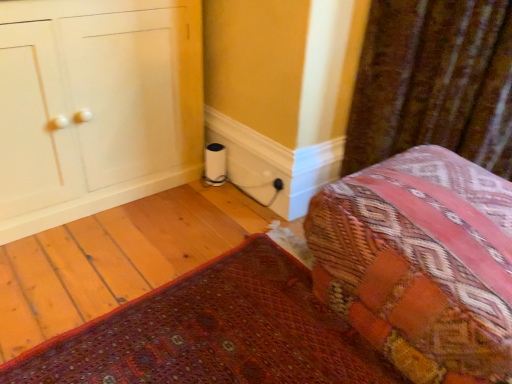
Question: Considering the relative sizes of textured woven bed at lower right and black plastic electric outlet at lower right in the image provided, is textured woven bed at lower right bigger than black plastic electric outlet at lower right?

Choices:
 (A) no
 (B) yes

Answer: (B)

Question: Considering the relative positions of textured woven bed at lower right and black plastic electric outlet at lower right in the image provided, is textured woven bed at lower right behind black plastic electric outlet at lower right?

Choices:
 (A) no
 (B) yes

Answer: (A)

Question: From a real-world perspective, is textured woven bed at lower right positioned over black plastic electric outlet at lower right based on gravity?

Choices:
 (A) no
 (B) yes

Answer: (B)

Question: Is the position of textured woven bed at lower right less distant than that of black plastic electric outlet at lower right?

Choices:
 (A) yes
 (B) no

Answer: (A)

Question: Can you confirm if textured woven bed at lower right is smaller than black plastic electric outlet at lower right?

Choices:
 (A) yes
 (B) no

Answer: (B)

Question: Is textured woven bed at lower right not close to black plastic electric outlet at lower right?

Choices:
 (A) yes
 (B) no

Answer: (B)

Question: Does patterned fabric cushion at lower right, marked as the second furniture in a top-to-bottom arrangement, come behind velvet brown curtain at upper right?

Choices:
 (A) yes
 (B) no

Answer: (B)

Question: Is velvet brown curtain at upper right located within patterned fabric cushion at lower right, marked as the second furniture in a top-to-bottom arrangement?

Choices:
 (A) no
 (B) yes

Answer: (A)

Question: Is patterned fabric cushion at lower right, marked as the second furniture in a top-to-bottom arrangement, shorter than velvet brown curtain at upper right?

Choices:
 (A) no
 (B) yes

Answer: (B)

Question: Is patterned fabric cushion at lower right, marked as the second furniture in a top-to-bottom arrangement, outside velvet brown curtain at upper right?

Choices:
 (A) no
 (B) yes

Answer: (B)

Question: Are patterned fabric cushion at lower right, marked as the second furniture in a top-to-bottom arrangement, and velvet brown curtain at upper right located far from each other?

Choices:
 (A) no
 (B) yes

Answer: (A)

Question: From a real-world perspective, is patterned fabric cushion at lower right, which ranks as the 1th furniture in bottom-to-top order, beneath velvet brown curtain at upper right?

Choices:
 (A) yes
 (B) no

Answer: (A)

Question: Does velvet brown curtain at upper right appear on the right side of patterned fabric cushion at lower right, marked as the second furniture in a top-to-bottom arrangement?

Choices:
 (A) no
 (B) yes

Answer: (B)